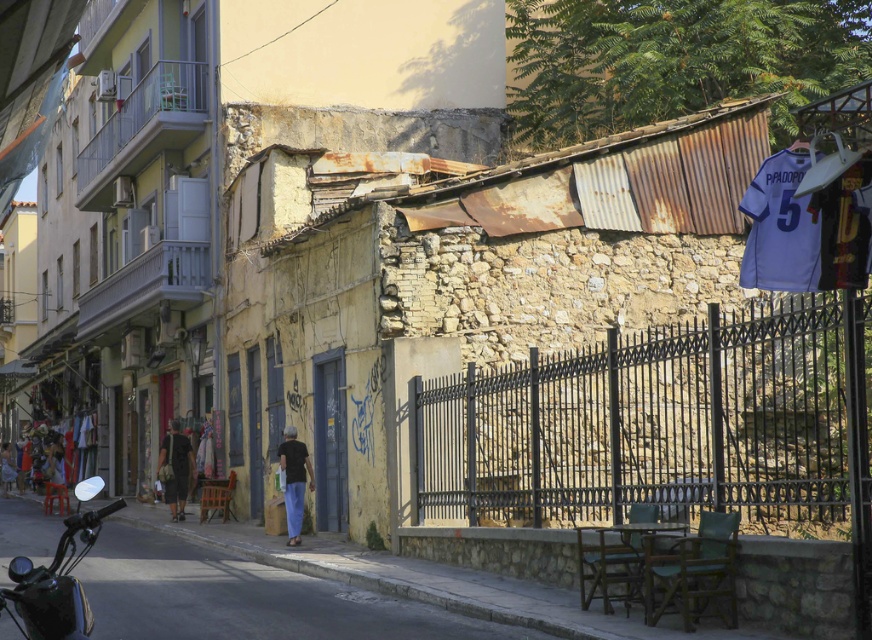
Can you confirm if black matte shirt at center is positioned to the left of dark brown leather jacket at lower left?

In fact, black matte shirt at center is to the right of dark brown leather jacket at lower left.

Is black matte shirt at center shorter than dark brown leather jacket at lower left?

No.

Who is more forward, [291,529] or [189,468]?

Positioned in front is point [291,529].

Identify the location of black matte shirt at center. The height and width of the screenshot is (640, 872). (294, 481).

Between point (11, 618) and point (172, 480), which one is positioned behind?

The point (172, 480) is more distant.

Consider the image. Does shiny black motorcycle at lower left have a smaller size compared to dark brown leather jacket at lower left?

Actually, shiny black motorcycle at lower left might be larger than dark brown leather jacket at lower left.

Is point (60, 582) farther from viewer compared to point (174, 442)?

No, it is in front of (174, 442).

Locate an element on the screen. This screenshot has width=872, height=640. shiny black motorcycle at lower left is located at coordinates coord(55,582).

Measure the distance from shiny black motorcycle at lower left to black matte shirt at center.

shiny black motorcycle at lower left and black matte shirt at center are 11.84 feet apart.

Does point (73, 577) come farther from viewer compared to point (296, 483)?

No.

Where is `shiny black motorcycle at lower left`? Image resolution: width=872 pixels, height=640 pixels. shiny black motorcycle at lower left is located at coordinates (55, 582).